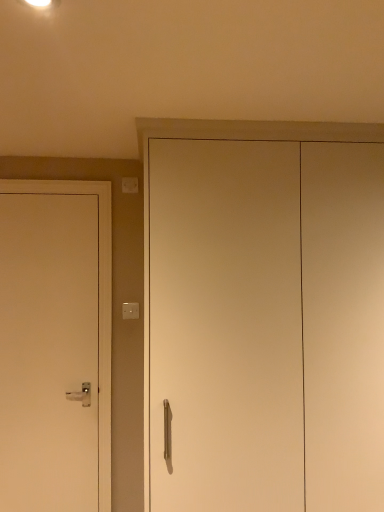
Question: Considering the relative sizes of white plastic light switch at upper center, the first light switch ordered from the bottom, and white plastic light switch at upper left, the first light switch from the top, in the image provided, is white plastic light switch at upper center, the first light switch ordered from the bottom, wider than white plastic light switch at upper left, the first light switch from the top,?

Choices:
 (A) no
 (B) yes

Answer: (A)

Question: Is white plastic light switch at upper center, the first light switch ordered from the bottom, not near white plastic light switch at upper left, acting as the 2th light switch starting from the bottom?

Choices:
 (A) no
 (B) yes

Answer: (A)

Question: Is white plastic light switch at upper left, the first light switch from the top, completely or partially inside white plastic light switch at upper center, the first light switch ordered from the bottom?

Choices:
 (A) no
 (B) yes

Answer: (A)

Question: Can you see white plastic light switch at upper center, the first light switch ordered from the bottom, touching white plastic light switch at upper left, acting as the 2th light switch starting from the bottom?

Choices:
 (A) yes
 (B) no

Answer: (B)

Question: Does white plastic light switch at upper center, the first light switch ordered from the bottom, have a greater height compared to white plastic light switch at upper left, acting as the 2th light switch starting from the bottom?

Choices:
 (A) yes
 (B) no

Answer: (B)

Question: Does white plastic light switch at upper center, arranged as the 2th light switch when viewed from the top, appear on the right side of white plastic light switch at upper left, the first light switch from the top?

Choices:
 (A) yes
 (B) no

Answer: (A)

Question: From the image's perspective, does white plastic light switch at upper left, acting as the 2th light switch starting from the bottom, appear lower than white matte door at left, which ranks as the 2th door in right-to-left order?

Choices:
 (A) no
 (B) yes

Answer: (A)

Question: From the image's perspective, does white plastic light switch at upper left, acting as the 2th light switch starting from the bottom, appear higher than white matte door at left, which is the first door in left-to-right order?

Choices:
 (A) no
 (B) yes

Answer: (B)

Question: Does white plastic light switch at upper left, the first light switch from the top, have a lesser height compared to white matte door at left, acting as the 2th door starting from the front?

Choices:
 (A) yes
 (B) no

Answer: (A)

Question: Is white plastic light switch at upper left, the first light switch from the top, behind white matte door at left, which ranks as the 2th door in right-to-left order?

Choices:
 (A) yes
 (B) no

Answer: (A)

Question: Can you confirm if white plastic light switch at upper left, the first light switch from the top, is wider than white matte door at left, acting as the 2th door starting from the front?

Choices:
 (A) yes
 (B) no

Answer: (B)

Question: Is white plastic light switch at upper left, the first light switch from the top, at the right side of white matte door at left, which is counted as the first door, starting from the back?

Choices:
 (A) no
 (B) yes

Answer: (B)

Question: Is white matte cabinet at center, which is counted as the first door, starting from the front, taller than white plastic light switch at upper center, arranged as the 2th light switch when viewed from the top?

Choices:
 (A) yes
 (B) no

Answer: (A)